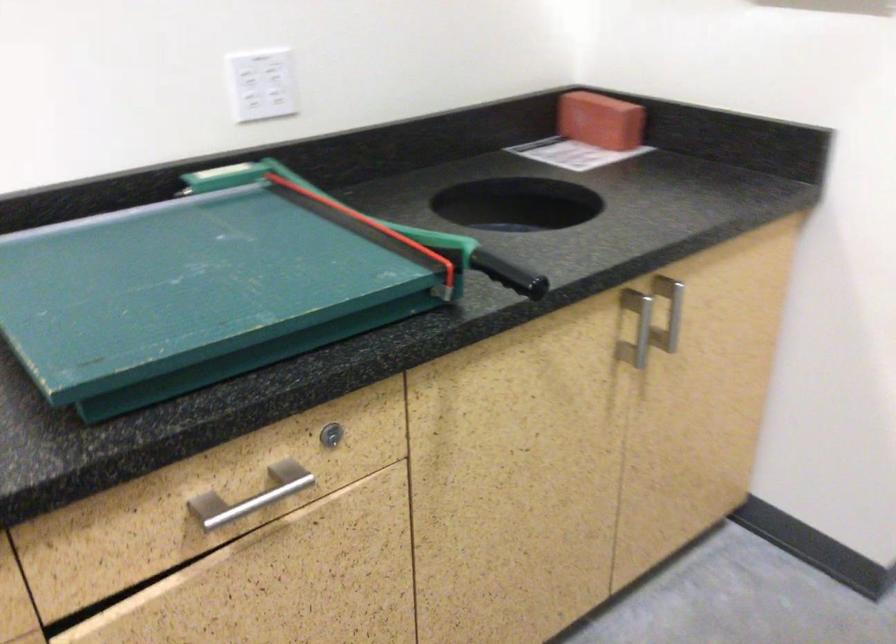
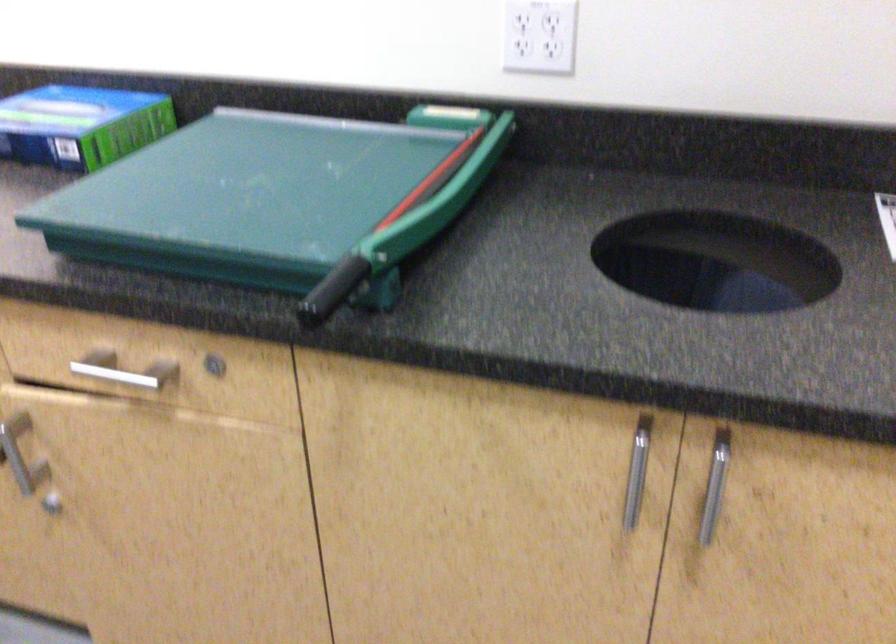
In the second image, find the point that corresponds to point (681, 312) in the first image.

(714, 486)